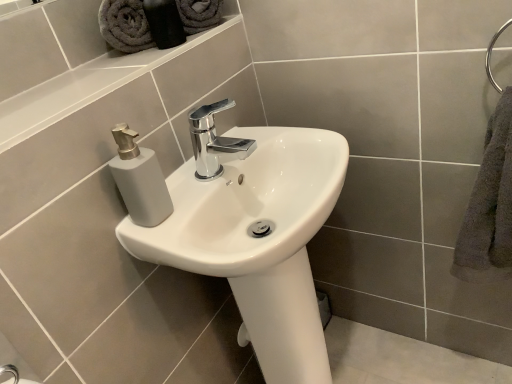
Question: Is gray cotton towel at upper left, the second bath towel when ordered from bottom to top, positioned far away from gray fluffy towel at right, which is the 2th bath towel in top-to-bottom order?

Choices:
 (A) yes
 (B) no

Answer: (B)

Question: From a real-world perspective, does gray cotton towel at upper left, acting as the first bath towel starting from the top, sit lower than gray fluffy towel at right, which is the 2th bath towel in top-to-bottom order?

Choices:
 (A) yes
 (B) no

Answer: (B)

Question: Considering the relative sizes of gray cotton towel at upper left, the second bath towel when ordered from bottom to top, and gray fluffy towel at right, which appears as the first bath towel when viewed from the right, in the image provided, is gray cotton towel at upper left, the second bath towel when ordered from bottom to top, thinner than gray fluffy towel at right, which appears as the first bath towel when viewed from the right,?

Choices:
 (A) yes
 (B) no

Answer: (A)

Question: Can you confirm if gray cotton towel at upper left, positioned as the second bath towel in right-to-left order, is shorter than gray fluffy towel at right, which ranks as the first bath towel in bottom-to-top order?

Choices:
 (A) no
 (B) yes

Answer: (B)

Question: Are gray cotton towel at upper left, positioned as the second bath towel in right-to-left order, and gray fluffy towel at right, which is counted as the second bath towel, starting from the left, beside each other?

Choices:
 (A) yes
 (B) no

Answer: (B)

Question: Is gray cotton towel at upper left, acting as the first bath towel starting from the top, aimed at gray fluffy towel at right, which is the 2th bath towel in top-to-bottom order?

Choices:
 (A) no
 (B) yes

Answer: (A)

Question: Is chrome metallic faucet at center positioned behind white glossy sink at center?

Choices:
 (A) no
 (B) yes

Answer: (B)

Question: From the image's perspective, is chrome metallic faucet at center above white glossy sink at center?

Choices:
 (A) no
 (B) yes

Answer: (B)

Question: From a real-world perspective, is chrome metallic faucet at center on top of white glossy sink at center?

Choices:
 (A) yes
 (B) no

Answer: (A)

Question: Is chrome metallic faucet at center thinner than white glossy sink at center?

Choices:
 (A) no
 (B) yes

Answer: (B)

Question: Is chrome metallic faucet at center at the right side of white glossy sink at center?

Choices:
 (A) yes
 (B) no

Answer: (B)

Question: Does chrome metallic faucet at center appear on the left side of white glossy sink at center?

Choices:
 (A) yes
 (B) no

Answer: (A)

Question: Does gray cotton towel at upper left, the second bath towel when ordered from bottom to top, have a larger size compared to gray fabric towels at upper left?

Choices:
 (A) yes
 (B) no

Answer: (B)